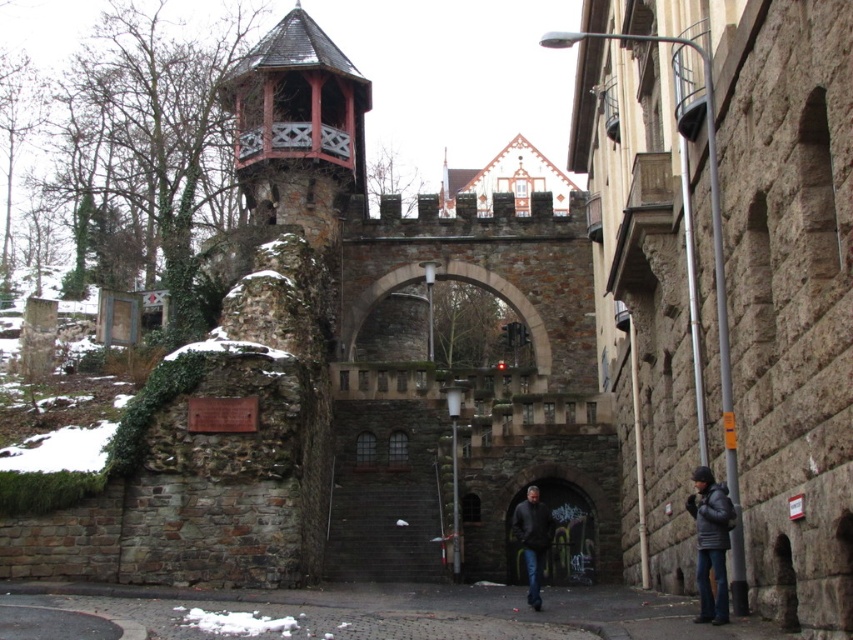
Question: Can you confirm if dark gray stone archway at center is positioned above dark gray puffy jacket at lower right?

Choices:
 (A) no
 (B) yes

Answer: (A)

Question: Which of these objects is positioned closest to the dark gray stone archway at center?

Choices:
 (A) dark gray puffy jacket at lower right
 (B) dark gray jacket at center
 (C) dark gray cobblestone alley at lower center
 (D) woodenmaterial/texturetower at upper center

Answer: (B)

Question: Observing the image, what is the correct spatial positioning of dark gray stone archway at center in reference to dark gray jacket at center?

Choices:
 (A) left
 (B) right

Answer: (B)

Question: Is dark gray stone archway at center below dark gray jacket at center?

Choices:
 (A) no
 (B) yes

Answer: (A)

Question: Among these points, which one is farthest from the camera?

Choices:
 (A) (531, 554)
 (B) (267, 124)

Answer: (B)

Question: Which object is the closest to the dark gray puffy jacket at lower right?

Choices:
 (A) dark gray cobblestone alley at lower center
 (B) woodenmaterial/texturetower at upper center
 (C) dark gray stone archway at center
 (D) dark gray jacket at center

Answer: (A)